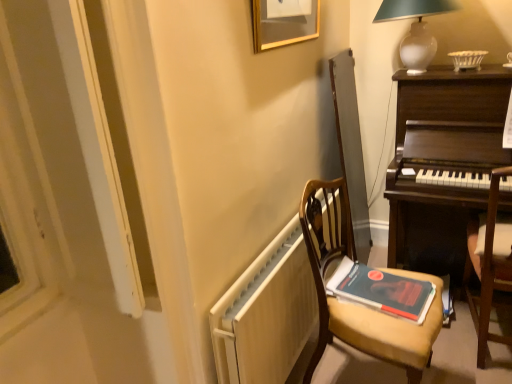
Find the location of a particular element. Image resolution: width=512 pixels, height=384 pixels. free spot above gold-framed picture at upper center (from a real-world perspective) is located at coordinates (284, 1).